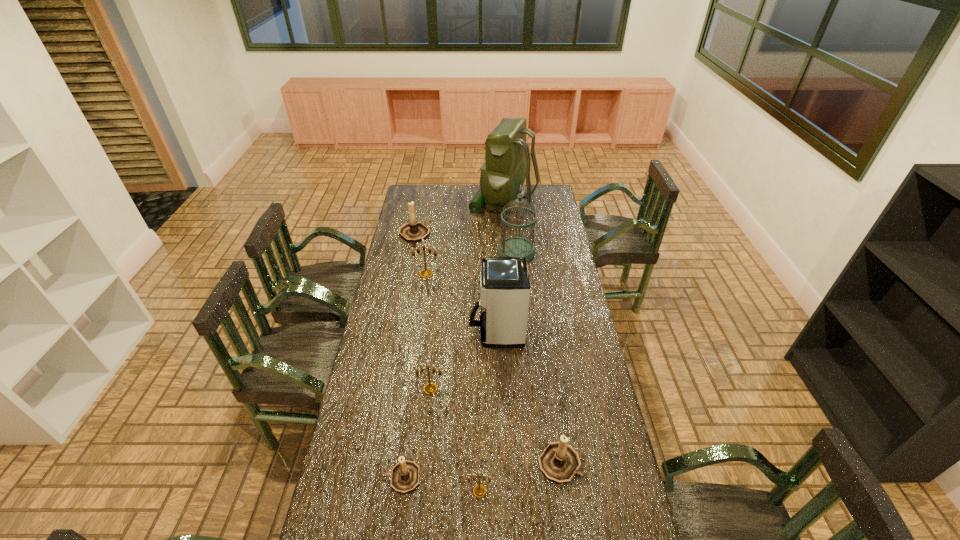
Identify the location of blank space located 0.390m on the front-facing side of the birdcage. This screenshot has height=540, width=960. (421, 252).

The height and width of the screenshot is (540, 960). In order to click on free space located on the front panel of the coffee maker in this screenshot , I will do `click(374, 332)`.

Find the location of a particular element. This screenshot has height=540, width=960. vacant space located on the front panel of the coffee maker is located at coordinates (424, 332).

Find the location of a particular element. free space located on the front panel of the coffee maker is located at coordinates (412, 332).

Image resolution: width=960 pixels, height=540 pixels. Identify the location of vacant space located 0.170m on the front of the biggest brown candle holder. 409,263.

The width and height of the screenshot is (960, 540). Identify the location of free space located on the front of the fifth nearest candelabrum. (422, 303).

Where is `vacant point located on the front of the fourth nearest candelabrum`? This screenshot has height=540, width=960. vacant point located on the front of the fourth nearest candelabrum is located at coordinates (423, 455).

You are a GUI agent. You are given a task and a screenshot of the screen. Output one action in this format:
    pyautogui.click(x=<x>, y=<y>)
    Task: Click on the vacant point located on the left of the rightmost brown candle holder
    The height and width of the screenshot is (540, 960).
    Given the screenshot: What is the action you would take?
    pyautogui.click(x=451, y=463)

This screenshot has width=960, height=540. Identify the location of vacant space located on the back of the smallest brown candle holder. 418,365.

The image size is (960, 540). I want to click on vacant position located 0.190m on the right of the nearest gold candelabrum, so click(553, 491).